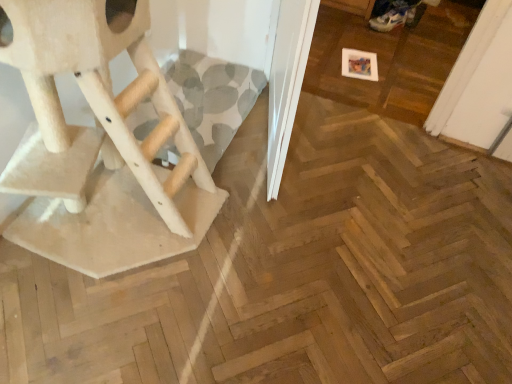
What do you see at coordinates (100, 147) in the screenshot? I see `beige carpeted cat tree at left` at bounding box center [100, 147].

At what (x,y) coordinates should I click in order to perform the action: click on beige carpeted cat tree at left. Please return your answer as a coordinate pair (x, y). Looking at the image, I should click on (100, 147).

This screenshot has height=384, width=512. What are the coordinates of `beige carpeted cat tree at left` in the screenshot? It's located at (100, 147).